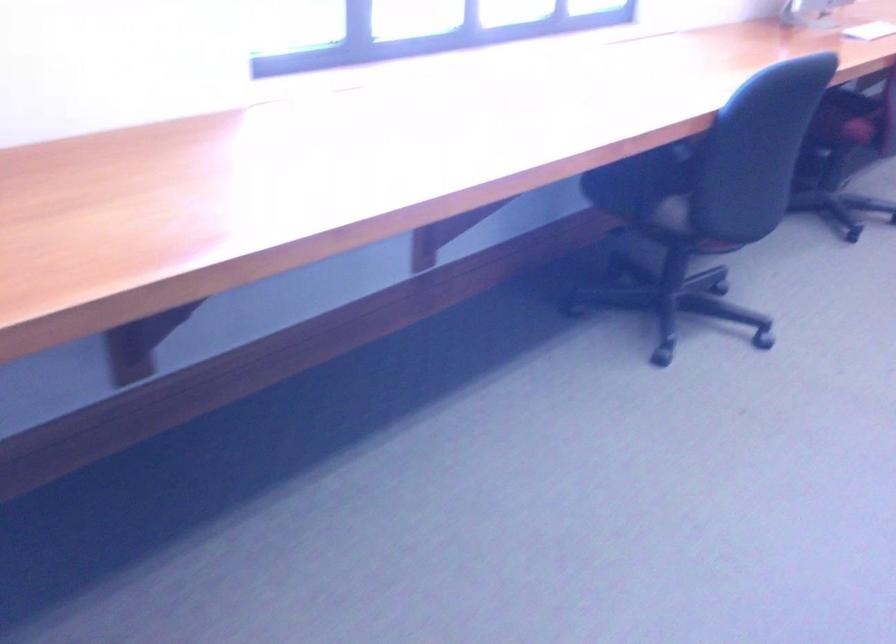
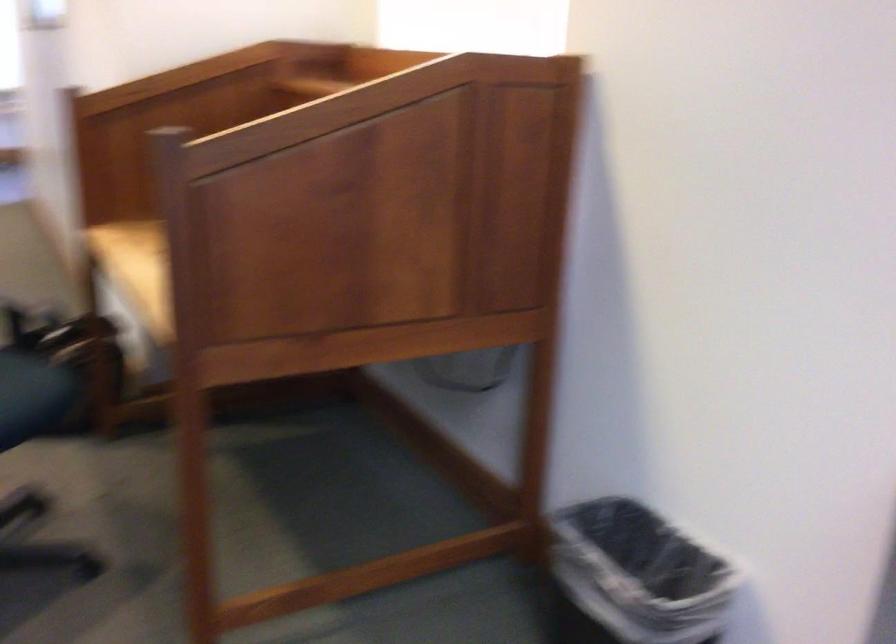
First-person continuous shooting, in which direction is the camera rotating?

The camera rotated toward left-down.